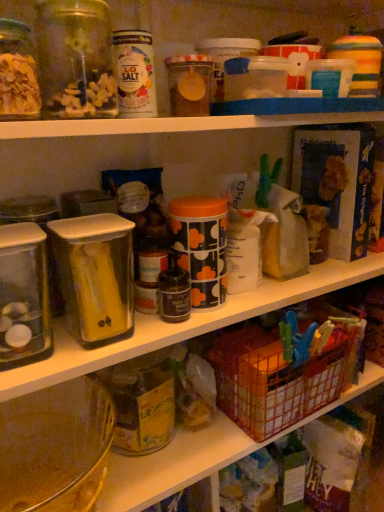
Question: Is clear plastic canister at center-left smaller than metallic wire basket at lower right?

Choices:
 (A) no
 (B) yes

Answer: (B)

Question: Is clear plastic canister at center-left positioned beyond the bounds of metallic wire basket at lower right?

Choices:
 (A) yes
 (B) no

Answer: (A)

Question: Does clear plastic canister at center-left have a lesser width compared to metallic wire basket at lower right?

Choices:
 (A) yes
 (B) no

Answer: (A)

Question: Is clear plastic canister at center-left to the right of metallic wire basket at lower right from the viewer's perspective?

Choices:
 (A) yes
 (B) no

Answer: (B)

Question: Can you confirm if clear plastic canister at center-left is wider than metallic wire basket at lower right?

Choices:
 (A) yes
 (B) no

Answer: (B)

Question: Can you confirm if clear plastic canister at center-left is positioned to the left of metallic wire basket at lower right?

Choices:
 (A) no
 (B) yes

Answer: (B)

Question: Considering the relative sizes of metallic wire basket at lower right and clear plastic canister at center-left in the image provided, is metallic wire basket at lower right wider than clear plastic canister at center-left?

Choices:
 (A) no
 (B) yes

Answer: (B)

Question: Is metallic wire basket at lower right further to the viewer compared to clear plastic canister at center-left?

Choices:
 (A) no
 (B) yes

Answer: (B)

Question: Is metallic wire basket at lower right placed right next to clear plastic canister at center-left?

Choices:
 (A) no
 (B) yes

Answer: (A)

Question: Is metallic wire basket at lower right closer to the viewer compared to clear plastic canister at center-left?

Choices:
 (A) yes
 (B) no

Answer: (B)

Question: Is metallic wire basket at lower right oriented away from clear plastic canister at center-left?

Choices:
 (A) no
 (B) yes

Answer: (A)

Question: Is metallic wire basket at lower right to the left of clear plastic canister at center-left from the viewer's perspective?

Choices:
 (A) yes
 (B) no

Answer: (B)

Question: From the image's perspective, is clear glass jar at upper left, which appears as the first glass jar when viewed from the top, below metallic wire basket at lower right?

Choices:
 (A) yes
 (B) no

Answer: (B)